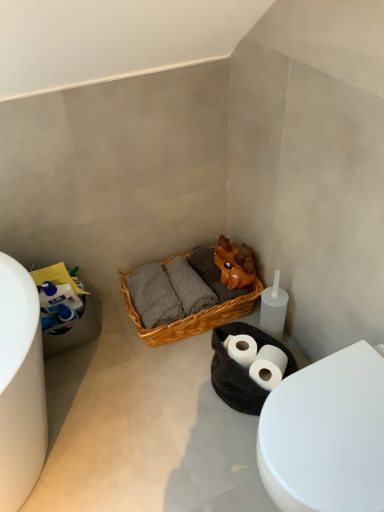
Question: From a real-world perspective, does woven wood picnic basket at center stand above white matte toilet paper at lower left?

Choices:
 (A) yes
 (B) no

Answer: (B)

Question: Does woven wood picnic basket at center appear on the right side of white matte toilet paper at lower left?

Choices:
 (A) no
 (B) yes

Answer: (B)

Question: Does woven wood picnic basket at center turn towards white matte toilet paper at lower left?

Choices:
 (A) no
 (B) yes

Answer: (A)

Question: Would you consider woven wood picnic basket at center to be distant from white matte toilet paper at lower left?

Choices:
 (A) no
 (B) yes

Answer: (A)

Question: From the image's perspective, does woven wood picnic basket at center appear higher than white matte toilet paper at lower left?

Choices:
 (A) no
 (B) yes

Answer: (A)

Question: Considering the positions of point (74, 287) and point (365, 442), is point (74, 287) closer or farther from the camera than point (365, 442)?

Choices:
 (A) farther
 (B) closer

Answer: (A)

Question: Looking at the image, does white matte toilet paper at lower left seem bigger or smaller compared to white glossy toilet at lower right?

Choices:
 (A) big
 (B) small

Answer: (B)

Question: From a real-world perspective, is white matte toilet paper at lower left positioned above or below white glossy toilet at lower right?

Choices:
 (A) below
 (B) above

Answer: (B)

Question: Is white matte toilet paper at lower left inside or outside of white glossy toilet at lower right?

Choices:
 (A) inside
 (B) outside

Answer: (B)

Question: In terms of width, does woven wood picnic basket at center look wider or thinner when compared to white matte toilet paper at lower left?

Choices:
 (A) wide
 (B) thin

Answer: (A)

Question: Would you say woven wood picnic basket at center is to the left or to the right of white matte toilet paper at lower left in the picture?

Choices:
 (A) left
 (B) right

Answer: (B)

Question: Does point (231, 310) appear closer or farther from the camera than point (48, 310)?

Choices:
 (A) farther
 (B) closer

Answer: (A)

Question: From a real-world perspective, is woven wood picnic basket at center positioned above or below white matte toilet paper at lower left?

Choices:
 (A) below
 (B) above

Answer: (A)

Question: Is white matte toilet paper at lower left wider or thinner than woven wood picnic basket at center?

Choices:
 (A) thin
 (B) wide

Answer: (A)

Question: Based on their positions, is white matte toilet paper at lower left located to the left or right of woven wood picnic basket at center?

Choices:
 (A) right
 (B) left

Answer: (B)